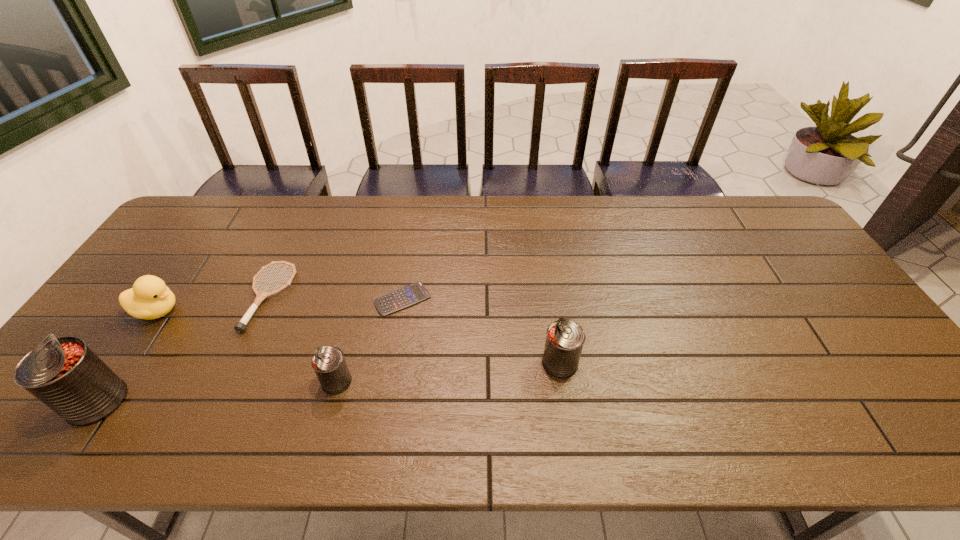
Please point out where to position a new can on the right to maintain spacing. Please provide its 2D coordinates. Your answer should be formatted as a tuple, i.e. [(x, y)], where the tuple contains the x and y coordinates of a point satisfying the conditions above.

[(769, 346)]